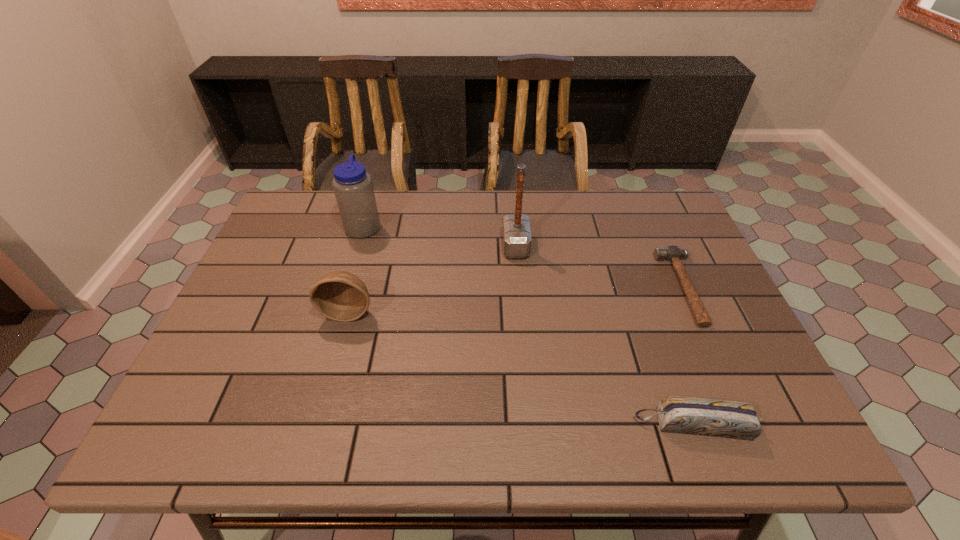
In order to click on free space that satisfies the following two spatial constraints: 1. with a carrying loop on the side of the second tallest object; 2. on the left side of the nearest object in this screenshot , I will do `click(304, 425)`.

This screenshot has width=960, height=540. Identify the location of free space that satisfies the following two spatial constraints: 1. on the back side of the nearest object; 2. with a carrying loop on the side of the water bottle. (621, 226).

Find the location of a particular element. Image resolution: width=960 pixels, height=540 pixels. blank space that satisfies the following two spatial constraints: 1. with a carrying loop on the side of the fourth shortest object; 2. on the back side of the fourth tallest object is located at coordinates (304, 425).

Identify the location of vacant space that satisfies the following two spatial constraints: 1. on the striking face of the right hammer; 2. on the front side of the second shortest object. The height and width of the screenshot is (540, 960). (746, 425).

Where is `free space that satisfies the following two spatial constraints: 1. on the back side of the third shortest object; 2. with a carrying loop on the side of the fourth shortest object`? The height and width of the screenshot is (540, 960). free space that satisfies the following two spatial constraints: 1. on the back side of the third shortest object; 2. with a carrying loop on the side of the fourth shortest object is located at coordinates (372, 226).

The image size is (960, 540). I want to click on free point that satisfies the following two spatial constraints: 1. on the front side of the third shortest object; 2. on the left side of the fourth tallest object, so pyautogui.click(x=317, y=425).

Find the location of `blank area in the image that satisfies the following two spatial constraints: 1. on the striking surface of the tallest object; 2. on the back side of the fourth tallest object`. blank area in the image that satisfies the following two spatial constraints: 1. on the striking surface of the tallest object; 2. on the back side of the fourth tallest object is located at coordinates (532, 425).

In order to click on vacant space that satisfies the following two spatial constraints: 1. on the striking surface of the pencil box; 2. on the left side of the taller hammer in this screenshot , I will do click(532, 425).

You are a GUI agent. You are given a task and a screenshot of the screen. Output one action in this format:
    pyautogui.click(x=<x>, y=<y>)
    Task: Click on the vacant area in the image that satisfies the following two spatial constraints: 1. with a carrying loop on the side of the fourth shortest object; 2. on the right side of the pencil box
    This screenshot has width=960, height=540.
    Given the screenshot: What is the action you would take?
    coord(304,425)